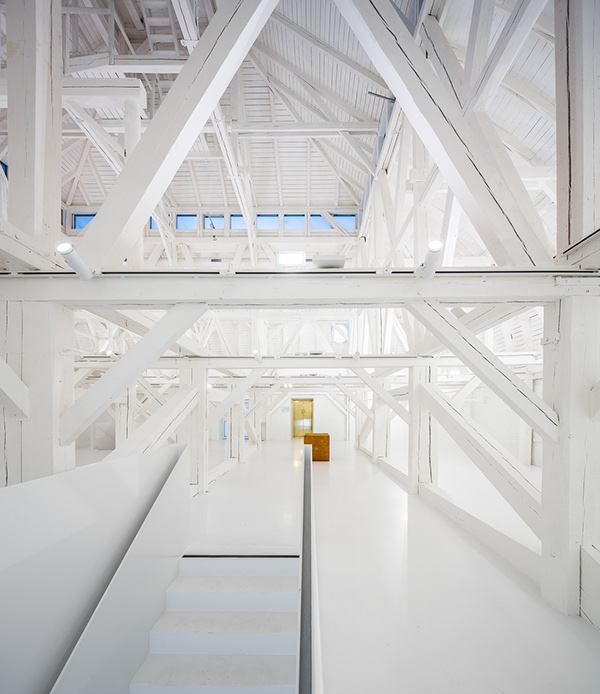
Where is `window`? The height and width of the screenshot is (694, 600). window is located at coordinates (533, 341).